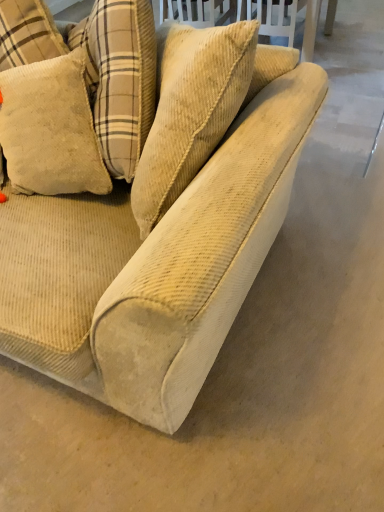
Question: Does beige corduroy pillow at upper left appear on the left side of beige corduroy couch at center?

Choices:
 (A) yes
 (B) no

Answer: (A)

Question: Is beige corduroy pillow at upper left outside beige corduroy couch at center?

Choices:
 (A) yes
 (B) no

Answer: (B)

Question: From a real-world perspective, is beige corduroy pillow at upper left below beige corduroy couch at center?

Choices:
 (A) yes
 (B) no

Answer: (B)

Question: Is beige corduroy pillow at upper left taller than beige corduroy couch at center?

Choices:
 (A) no
 (B) yes

Answer: (A)

Question: From a real-world perspective, is beige corduroy pillow at upper left positioned over beige corduroy couch at center based on gravity?

Choices:
 (A) yes
 (B) no

Answer: (A)

Question: Could you tell me if beige corduroy pillow at upper left is turned towards beige corduroy couch at center?

Choices:
 (A) no
 (B) yes

Answer: (B)

Question: Is beige corduroy couch at center facing towards beige corduroy pillow at upper left?

Choices:
 (A) yes
 (B) no

Answer: (A)

Question: From a real-world perspective, is beige corduroy couch at center on top of beige corduroy pillow at upper left?

Choices:
 (A) yes
 (B) no

Answer: (B)

Question: Considering the relative sizes of beige corduroy couch at center and beige corduroy pillow at upper left in the image provided, is beige corduroy couch at center taller than beige corduroy pillow at upper left?

Choices:
 (A) no
 (B) yes

Answer: (B)

Question: Can you confirm if beige corduroy couch at center is positioned to the left of beige corduroy pillow at upper left?

Choices:
 (A) no
 (B) yes

Answer: (A)

Question: Is beige corduroy couch at center oriented away from beige corduroy pillow at upper left?

Choices:
 (A) no
 (B) yes

Answer: (B)

Question: Is beige corduroy couch at center beside beige corduroy pillow at upper left?

Choices:
 (A) no
 (B) yes

Answer: (A)

Question: Choose the correct answer: Is beige corduroy pillow at upper left inside beige corduroy couch at center or outside it?

Choices:
 (A) outside
 (B) inside

Answer: (B)